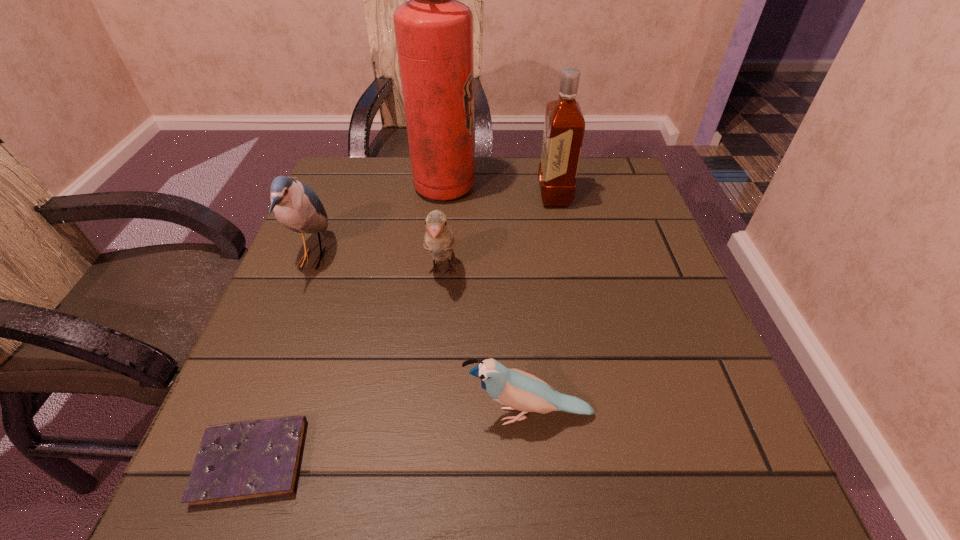
The height and width of the screenshot is (540, 960). What are the coordinates of `bird situated at the left edge` in the screenshot? It's located at (296, 206).

Image resolution: width=960 pixels, height=540 pixels. What are the coordinates of `diary that is at the left edge` in the screenshot? It's located at (244, 461).

This screenshot has width=960, height=540. What are the coordinates of `object at the near left corner` in the screenshot? It's located at (244, 461).

Where is `blank space at the far edge of the desktop`? blank space at the far edge of the desktop is located at coordinates (483, 184).

At what (x,y) coordinates should I click in order to perform the action: click on vacant space at the near edge. Please return your answer as a coordinate pair (x, y). Looking at the image, I should click on (586, 458).

This screenshot has width=960, height=540. Find the location of `vacant space at the left edge of the desktop`. vacant space at the left edge of the desktop is located at coordinates click(x=323, y=406).

Where is `vacant space at the right edge`? The width and height of the screenshot is (960, 540). vacant space at the right edge is located at coordinates (692, 390).

Find the location of a particular element. free location at the far left corner is located at coordinates (364, 168).

This screenshot has height=540, width=960. Find the location of `blank area at the far right corner`. blank area at the far right corner is located at coordinates (612, 179).

You are a GUI agent. You are given a task and a screenshot of the screen. Output one action in this format:
    pyautogui.click(x=<x>, y=<y>)
    Task: Click on the vacant space at the near right corner of the desktop
    The height and width of the screenshot is (540, 960).
    Given the screenshot: What is the action you would take?
    pyautogui.click(x=657, y=500)